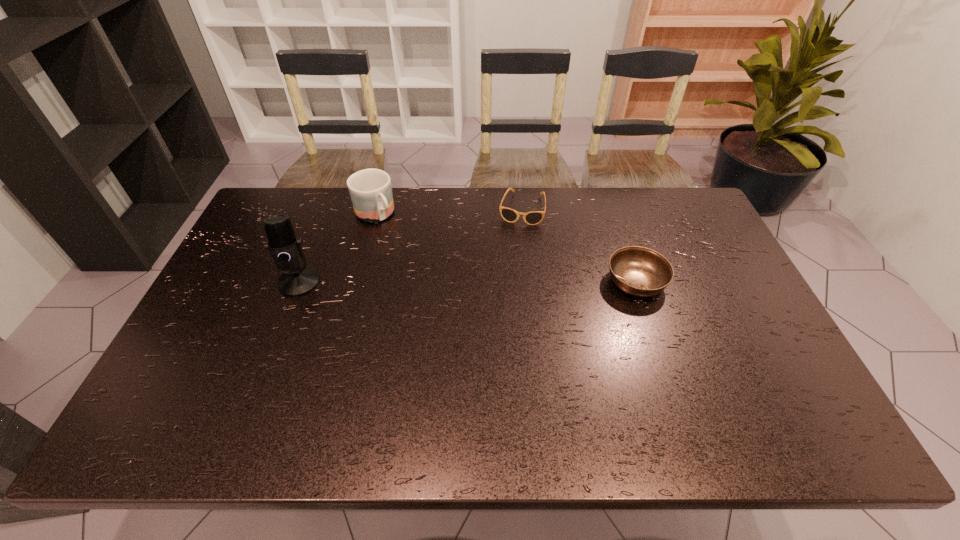
The image size is (960, 540). Identify the location of blank space located 0.070m on the side with the handle of the third object from right to left. (395, 239).

Locate an element on the screen. free spot located 0.270m on the front-facing side of the sunglasses is located at coordinates (505, 282).

Where is `vacant point located on the front-facing side of the sunglasses`? Image resolution: width=960 pixels, height=540 pixels. vacant point located on the front-facing side of the sunglasses is located at coordinates (508, 268).

Identify the location of vacant point located on the front-facing side of the sunglasses. (508, 271).

Where is `mug located in the far edge section of the desktop`? The width and height of the screenshot is (960, 540). mug located in the far edge section of the desktop is located at coordinates (370, 190).

In order to click on sunglasses positioned at the far edge in this screenshot , I will do `click(510, 215)`.

You are a GUI agent. You are given a task and a screenshot of the screen. Output one action in this format:
    pyautogui.click(x=<x>, y=<y>)
    Task: Click on the vacant space at the far edge of the desktop
    The image size is (960, 540).
    Given the screenshot: What is the action you would take?
    pyautogui.click(x=568, y=210)

In the image, there is a desktop. Find the location of `free region at the left edge`. free region at the left edge is located at coordinates (241, 326).

Locate an element on the screen. free space at the right edge is located at coordinates (719, 266).

The image size is (960, 540). What are the coordinates of `free location at the far left corner` in the screenshot? It's located at (276, 190).